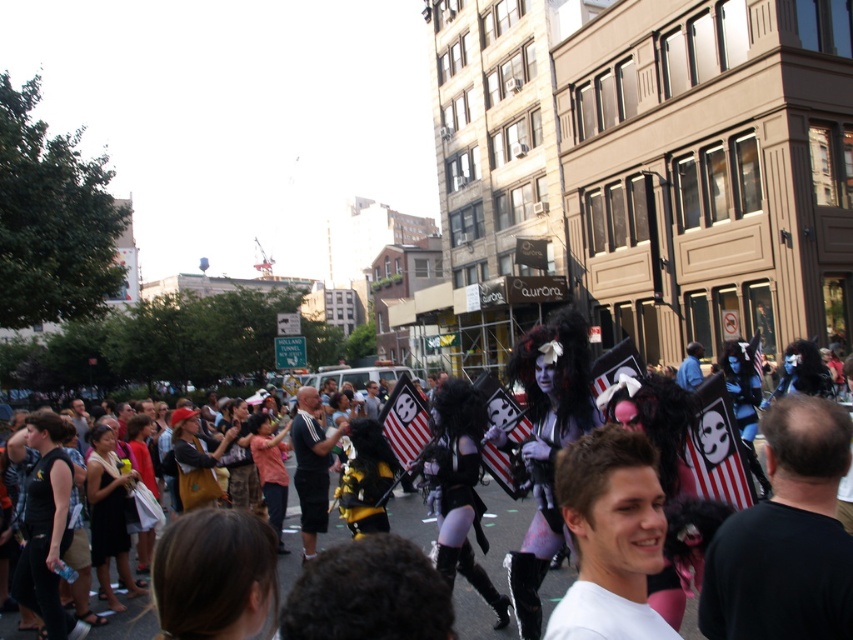
You are a photographer at the parade and want to capture both the white matte shirt at center and the striped fabric flag at center in a single shot. Which object should you position closer to the left side of your camera frame to ensure both are visible?

To ensure both the white matte shirt at center and the striped fabric flag at center are visible in the shot, position the striped fabric flag at center closer to the left side of your camera frame since the white matte shirt at center is to the right of it.

You are a photographer trying to capture a clear shot of the white matte shirt at center and the black glossy mask at center during the parade. Since the two are positioned close to each other, you need to adjust your camera settings to ensure both are in focus. Considering their sizes, which object should you focus on first to maximize clarity?

The white matte shirt at center is thinner than the black glossy mask at center, so focusing on the black glossy mask at center first would be better because thicker objects generally require more precise focus to maintain clarity.